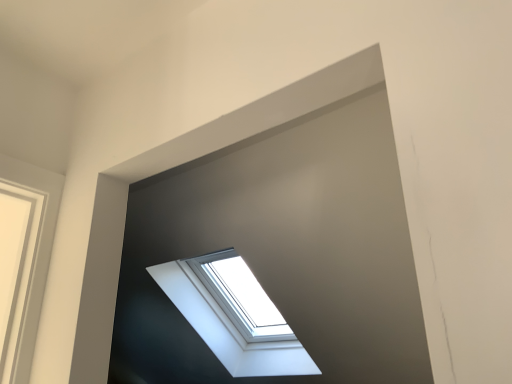
What do you see at coordinates (228, 328) in the screenshot? The height and width of the screenshot is (384, 512). I see `transparent glass window at upper center` at bounding box center [228, 328].

This screenshot has height=384, width=512. I want to click on transparent glass window at upper center, so click(228, 328).

In the scene shown: What is the approximate height of transparent glass window at upper center?

transparent glass window at upper center is 68.00 centimeters in height.

Where is `transparent glass window at upper center`? transparent glass window at upper center is located at coordinates (228, 328).